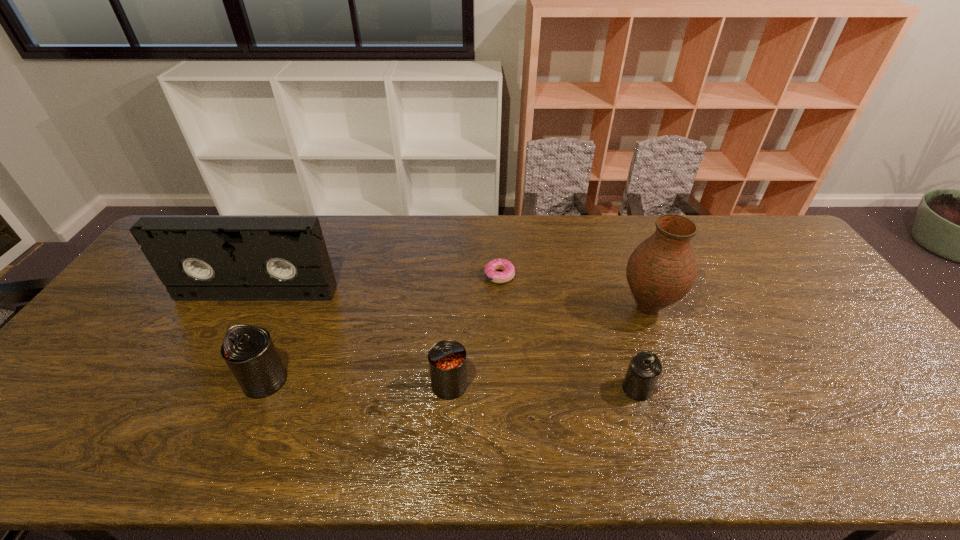
At what (x,y) coordinates should I click in order to perform the action: click on free space between the fourth shortest object and the shortest object. Please return your answer as a coordinate pair (x, y). This screenshot has height=540, width=960. Looking at the image, I should click on (382, 328).

Locate an element on the screen. The width and height of the screenshot is (960, 540). empty location between the videotape and the second tallest can is located at coordinates (353, 339).

Identify which object is the second closest to the farthest object. Please provide its 2D coordinates. Your answer should be formatted as a tuple, i.e. [(x, y)], where the tuple contains the x and y coordinates of a point satisfying the conditions above.

[(447, 359)]

Image resolution: width=960 pixels, height=540 pixels. I want to click on object that stands as the third closest to the videotape, so click(507, 267).

Where is `can that is the second closest one to the doughnut`? This screenshot has width=960, height=540. can that is the second closest one to the doughnut is located at coordinates (644, 369).

The height and width of the screenshot is (540, 960). In order to click on the third closest can to the vase in this screenshot , I will do pos(249,351).

This screenshot has height=540, width=960. In order to click on vacant point that satisfies the following two spatial constraints: 1. on the side of the videotape with visible spindles; 2. on the left side of the vase in this screenshot , I will do `click(249, 308)`.

Image resolution: width=960 pixels, height=540 pixels. I want to click on vacant position in the image that satisfies the following two spatial constraints: 1. on the front side of the fourth shortest object; 2. on the left side of the fourth tallest object, so click(x=263, y=384).

I want to click on free space that satisfies the following two spatial constraints: 1. on the back side of the vase; 2. on the right side of the second tallest can, so click(x=454, y=308).

This screenshot has width=960, height=540. What are the coordinates of `free spot that satisfies the following two spatial constraints: 1. on the side of the rightmost can with visible spindles; 2. on the right side of the videotape` in the screenshot? It's located at (205, 388).